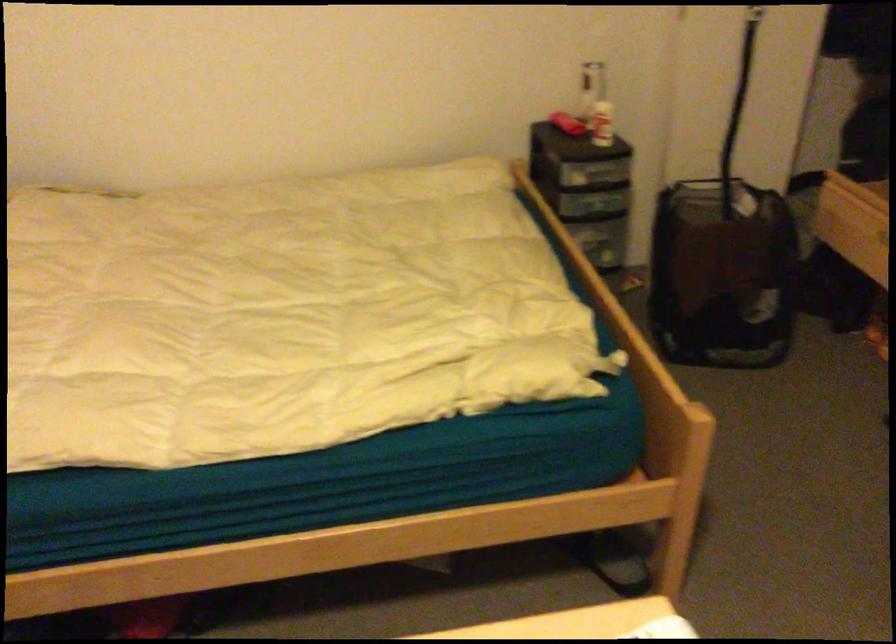
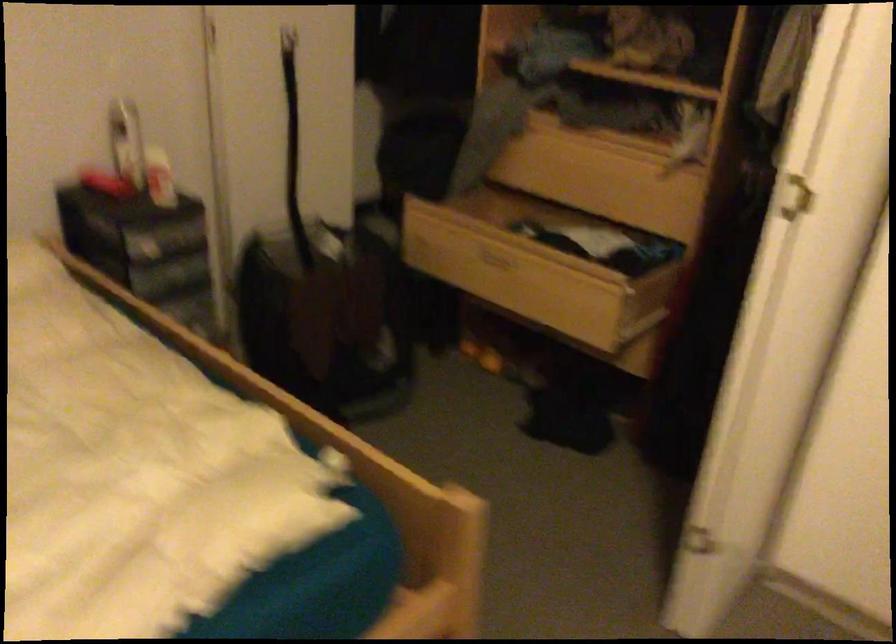
Question: The first image is from the beginning of the video and the second image is from the end. How did the camera likely rotate when shooting the video?

Choices:
 (A) Left
 (B) Right
 (C) Up
 (D) Down

Answer: (B)